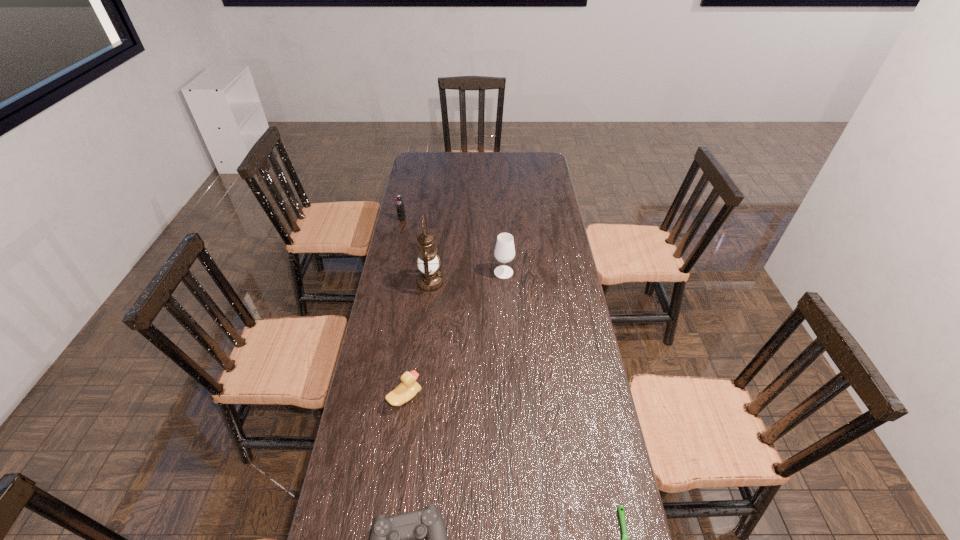
This screenshot has height=540, width=960. Find the location of `vacant space located at the beak of the third nearest object`. vacant space located at the beak of the third nearest object is located at coordinates (503, 397).

Identify the location of oil lamp that is at the left edge. The height and width of the screenshot is (540, 960). (429, 279).

Locate an element on the screen. This screenshot has height=540, width=960. pop situated at the left edge is located at coordinates (401, 215).

Find the location of a particular element. The height and width of the screenshot is (540, 960). duck situated at the left edge is located at coordinates (408, 388).

At what (x,y) coordinates should I click in order to perform the action: click on vacant region at the far edge. Please return your answer as a coordinate pair (x, y). The image size is (960, 540). Looking at the image, I should click on click(485, 153).

What are the coordinates of `vacant space at the left edge of the desktop` in the screenshot? It's located at (390, 270).

In the image, there is a desktop. At what (x,y) coordinates should I click in order to perform the action: click on vacant space at the right edge. Please return your answer as a coordinate pair (x, y). The width and height of the screenshot is (960, 540). Looking at the image, I should click on (571, 261).

This screenshot has width=960, height=540. I want to click on vacant space at the far left corner of the desktop, so click(428, 152).

Identify the location of vacant space at the far right corner of the desktop. (540, 164).

Locate an element on the screen. free area in between the glass and the fourth farthest object is located at coordinates (454, 335).